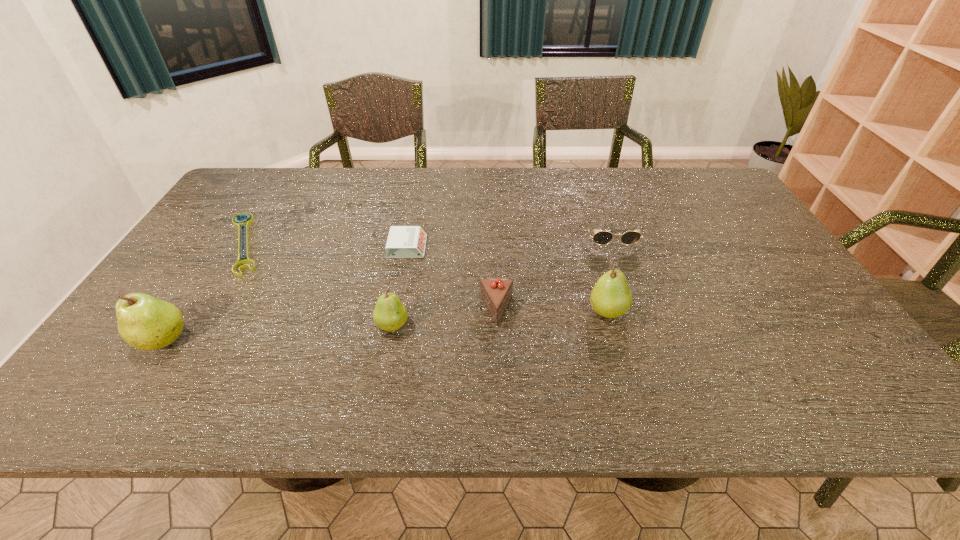
Find the location of a particular element. vacant area that lies between the sixth tallest object and the chocolate cake is located at coordinates (452, 278).

Find the location of a particular element. The width and height of the screenshot is (960, 540). empty space between the fifth shortest object and the chocolate cake is located at coordinates (444, 318).

Image resolution: width=960 pixels, height=540 pixels. In order to click on object that is the second closest to the second tallest object in this screenshot , I will do `click(603, 237)`.

Locate an element on the screen. This screenshot has width=960, height=540. object that is the sixth closest one to the tallest pear is located at coordinates (603, 237).

Locate which pear is the second closest to the rightmost pear. Please provide its 2D coordinates. Your answer should be formatted as a tuple, i.e. [(x, y)], where the tuple contains the x and y coordinates of a point satisfying the conditions above.

[(146, 323)]

Locate an element on the screen. The image size is (960, 540). the closest pear to the shortest object is located at coordinates (146, 323).

I want to click on vacant space that satisfies the following two spatial constraints: 1. on the front side of the second tallest pear; 2. on the left side of the alarm clock, so click(396, 311).

This screenshot has height=540, width=960. I want to click on vacant position in the image that satisfies the following two spatial constraints: 1. on the back side of the sixth shortest object; 2. on the left side of the leftmost pear, so click(182, 311).

Where is `free space that satisfies the following two spatial constraints: 1. on the front side of the second tallest object; 2. on the left side of the wrench`? free space that satisfies the following two spatial constraints: 1. on the front side of the second tallest object; 2. on the left side of the wrench is located at coordinates (202, 311).